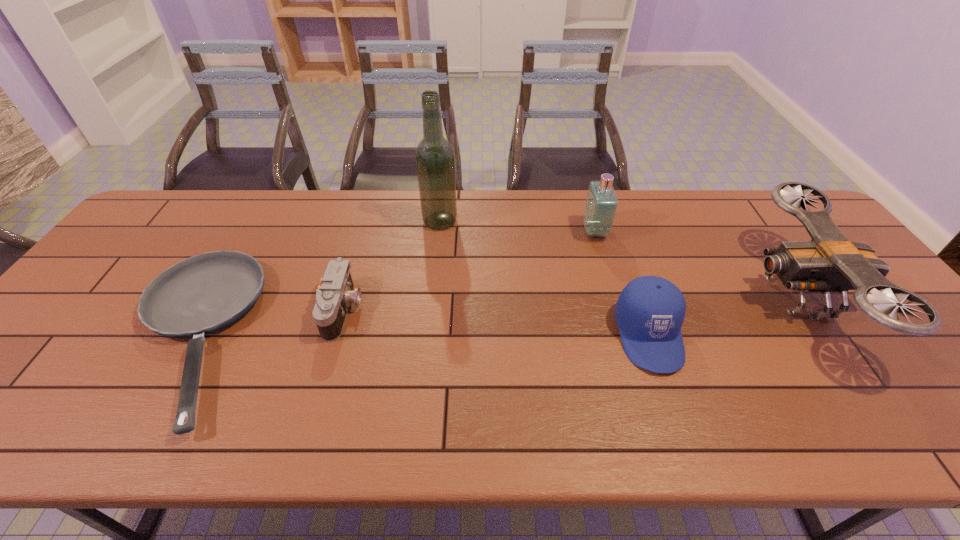
In order to click on vacant space situated 0.330m on the front-facing side of the drone in this screenshot , I will do `click(622, 298)`.

In order to click on vacant space located on the front-facing side of the drone in this screenshot , I will do `click(649, 298)`.

Identify the location of blank space located on the front-facing side of the drone. This screenshot has width=960, height=540. (717, 298).

Find the location of a particular element. The height and width of the screenshot is (540, 960). free location located 0.200m on the front label of the perfume is located at coordinates (518, 231).

In order to click on blank space located on the front label of the perfume in this screenshot , I will do `click(535, 231)`.

You are a GUI agent. You are given a task and a screenshot of the screen. Output one action in this format:
    pyautogui.click(x=<x>, y=<y>)
    Task: Click on the free space located 0.130m on the front label of the perfume
    This screenshot has width=960, height=540.
    Given the screenshot: What is the action you would take?
    pyautogui.click(x=541, y=231)

The image size is (960, 540). I want to click on free space located 0.130m on the front-facing side of the cap, so click(x=682, y=431).

I want to click on vacant region located on the lens of the camera, so click(416, 310).

The height and width of the screenshot is (540, 960). Identify the location of free space located on the back of the frying pan. (249, 232).

Identify the location of liquor at the far edge. pyautogui.click(x=435, y=162).